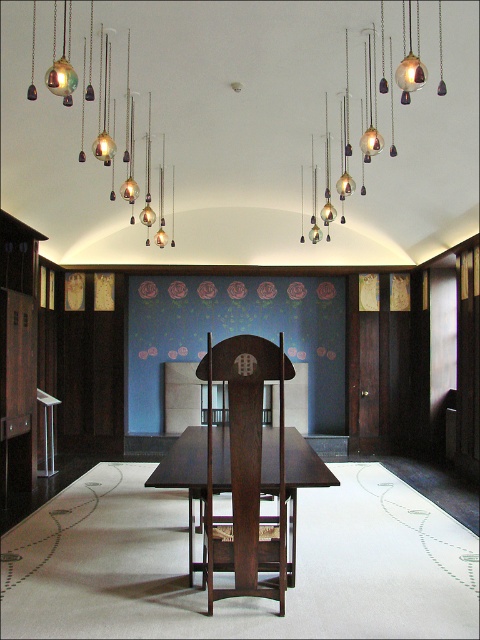
Question: Does dark wood chair at center come behind metallic glass pendants at upper center?

Choices:
 (A) no
 (B) yes

Answer: (A)

Question: Which point is farther to the camera?

Choices:
 (A) dark wood table at center
 (B) metallic glass globe chandelier at upper left
 (C) dark wood chair at center
 (D) metallic glass pendants at upper center

Answer: (D)

Question: Which of the following is the closest to the observer?

Choices:
 (A) metallic glass pendants at upper center
 (B) dark wood chair at center
 (C) metallic glass globe chandelier at upper left
 (D) dark wood table at center

Answer: (B)

Question: Does dark wood chair at center have a lesser width compared to metallic glass pendants at upper center?

Choices:
 (A) yes
 (B) no

Answer: (A)

Question: Which of the following is the closest to the observer?

Choices:
 (A) metallic glass pendants at upper center
 (B) metallic glass globe chandelier at upper left

Answer: (B)

Question: Does dark wood table at center have a smaller size compared to metallic glass pendants at upper center?

Choices:
 (A) no
 (B) yes

Answer: (A)